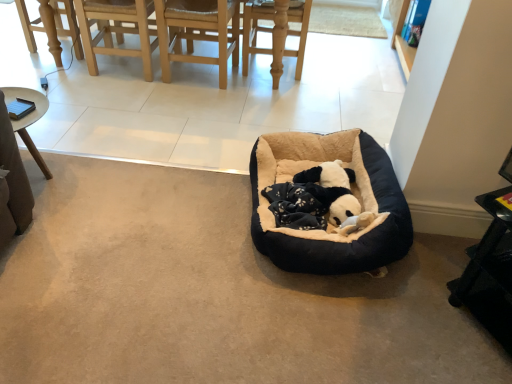
Question: Is black plastic table at lower right looking in the opposite direction of black plush dog bed at center?

Choices:
 (A) no
 (B) yes

Answer: (A)

Question: From a real-world perspective, is black plastic table at lower right positioned over black plush dog bed at center based on gravity?

Choices:
 (A) yes
 (B) no

Answer: (A)

Question: Does black plastic table at lower right have a lesser height compared to black plush dog bed at center?

Choices:
 (A) no
 (B) yes

Answer: (A)

Question: From the image's perspective, is black plastic table at lower right located beneath black plush dog bed at center?

Choices:
 (A) no
 (B) yes

Answer: (B)

Question: Is black plastic table at lower right thinner than black plush dog bed at center?

Choices:
 (A) yes
 (B) no

Answer: (A)

Question: Considering the relative sizes of black plastic table at lower right and black plush dog bed at center in the image provided, is black plastic table at lower right wider than black plush dog bed at center?

Choices:
 (A) yes
 (B) no

Answer: (B)

Question: Is light wood chair at upper left facing away from black plush dog bed at center?

Choices:
 (A) yes
 (B) no

Answer: (B)

Question: Considering the relative sizes of light wood chair at upper left and black plush dog bed at center in the image provided, is light wood chair at upper left shorter than black plush dog bed at center?

Choices:
 (A) no
 (B) yes

Answer: (A)

Question: Is light wood chair at upper left to the left of black plush dog bed at center from the viewer's perspective?

Choices:
 (A) yes
 (B) no

Answer: (A)

Question: From the image's perspective, is light wood chair at upper left on top of black plush dog bed at center?

Choices:
 (A) yes
 (B) no

Answer: (A)

Question: Is light wood chair at upper left placed right next to black plush dog bed at center?

Choices:
 (A) no
 (B) yes

Answer: (A)

Question: From a real-world perspective, does light wood chair at upper left stand above black plush dog bed at center?

Choices:
 (A) no
 (B) yes

Answer: (B)

Question: Is black plush dog bed at center turned away from black plastic table at lower right?

Choices:
 (A) no
 (B) yes

Answer: (B)